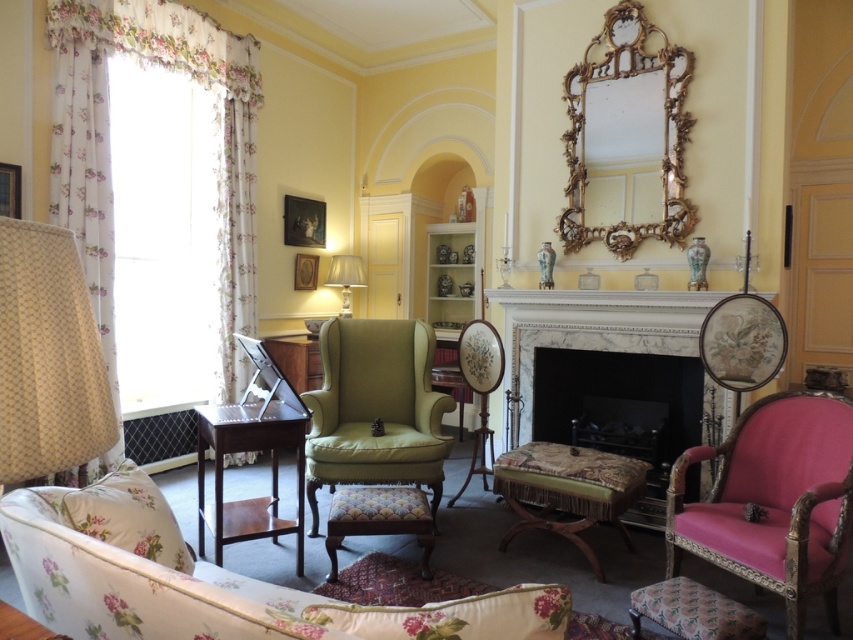
Is velvet green armchair at center positioned before marble fireplace at center?

Yes, velvet green armchair at center is in front of marble fireplace at center.

Measure the distance between velvet green armchair at center and camera.

velvet green armchair at center and camera are 3.48 meters apart.

Who is more forward, [321,460] or [523,337]?

Positioned in front is point [321,460].

Where is `velvet green armchair at center`? The height and width of the screenshot is (640, 853). velvet green armchair at center is located at coordinates (375, 408).

Does floral fabric curtain at left appear on the right side of wooden picture frame at center?

No, floral fabric curtain at left is not to the right of wooden picture frame at center.

Does floral fabric curtain at left lie in front of wooden picture frame at center?

Yes, it is.

This screenshot has height=640, width=853. In order to click on floral fabric curtain at left in this screenshot , I will do `click(109, 147)`.

Is point (10, 204) more distant than point (302, 256)?

No, (10, 204) is closer to viewer.

You are a GUI agent. You are given a task and a screenshot of the screen. Output one action in this format:
    pyautogui.click(x=<x>, y=<y>)
    Task: Click on the wooden picture frame at left
    
    Given the screenshot: What is the action you would take?
    pyautogui.click(x=9, y=189)